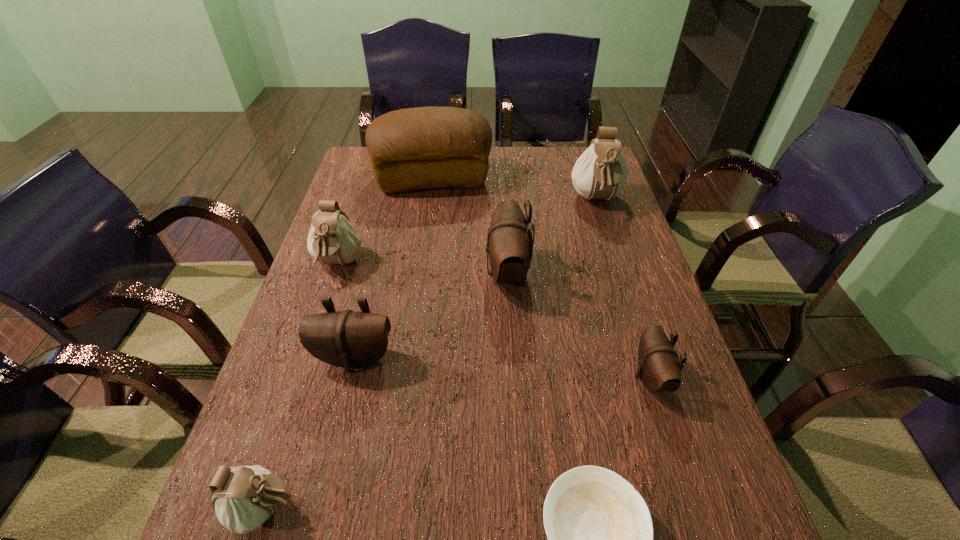
This screenshot has width=960, height=540. Find the location of `vacant area located 0.060m with the flap open on the biggest brown pouch`. vacant area located 0.060m with the flap open on the biggest brown pouch is located at coordinates (463, 273).

Where is `vacant space located 0.300m with the flap open on the biggest brown pouch`? vacant space located 0.300m with the flap open on the biggest brown pouch is located at coordinates (373, 273).

You are a GUI agent. You are given a task and a screenshot of the screen. Output one action in this format:
    pyautogui.click(x=<x>, y=<y>)
    Task: Click on the blank space located 0.110m with the flap open on the biggest brown pouch
    This screenshot has height=540, width=960.
    Given the screenshot: What is the action you would take?
    pyautogui.click(x=444, y=273)

The width and height of the screenshot is (960, 540). Find the location of `vacant space located on the front-facing side of the second smallest white pouch`. vacant space located on the front-facing side of the second smallest white pouch is located at coordinates (325, 302).

Where is `vacant point located with the flap open on the second biggest brown pouch`? Image resolution: width=960 pixels, height=540 pixels. vacant point located with the flap open on the second biggest brown pouch is located at coordinates (327, 475).

Image resolution: width=960 pixels, height=540 pixels. In order to click on blank space located 0.190m with the flap open on the rightmost brown pouch in this screenshot , I will do `click(546, 377)`.

The height and width of the screenshot is (540, 960). Identify the location of vacant space located 0.220m with the flap open on the rightmost brown pouch. (533, 377).

Image resolution: width=960 pixels, height=540 pixels. Find the location of `vacant space situated 0.290m with the flap open on the rightmost brown pouch`. vacant space situated 0.290m with the flap open on the rightmost brown pouch is located at coordinates (500, 377).

You are a GUI agent. You are given a task and a screenshot of the screen. Output one action in this format:
    pyautogui.click(x=<x>, y=<y>)
    Task: Click on the object located at the far edge
    The width and height of the screenshot is (960, 540).
    Given the screenshot: What is the action you would take?
    pyautogui.click(x=429, y=147)

Locate an element on the screen. Image resolution: width=960 pixels, height=540 pixels. bread at the left edge is located at coordinates (429, 147).